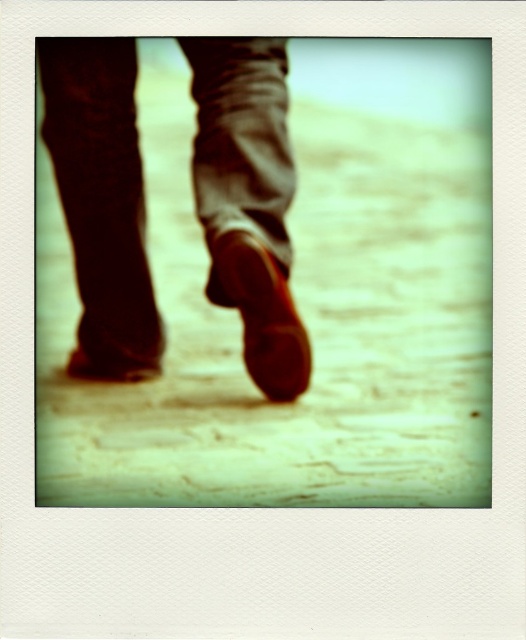
You are standing in a vintage Polaroid scene where you see the yellow stone pavement at center and the shiny brown shoe at center. Which object is closer to the camera?

The yellow stone pavement at center is located above the shiny brown shoe at center, meaning it is closer to the camera.

You are standing in front of a vintage Polaroid photo. There is a point marked at coordinates (248, 198). What object is located at that point?

The point at coordinates (248, 198) indicates the location of the matte brown shoe at center.

You are a photographer trying to capture the shiny brown shoe at center and the yellow stone pavement at center in a new shot. Based on their heights, which one should you focus on first if you want both to be in sharp focus?

The yellow stone pavement at center is much taller than the shiny brown shoe at center, so you should focus on the yellow stone pavement at center first to ensure both are in sharp focus.